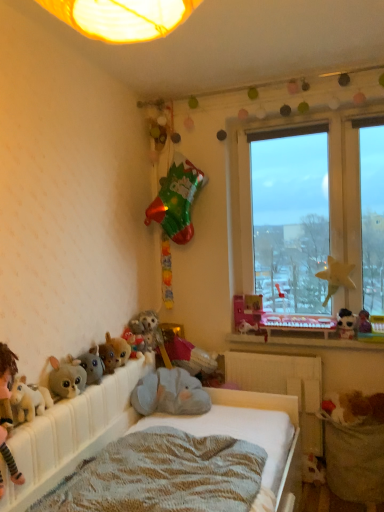
What is the approximate height of fluffy plush elephant at center, which is the 7th toy in left-to-right order?

It is 30.54 centimeters.

What is the approximate width of pink matte book at window, positioned as the 1th toy in right-to-left order?

It is 4.46 inches.

Where is `wooden at lower right`? This screenshot has height=512, width=384. wooden at lower right is located at coordinates (299, 341).

Find the location of `transparent glass window at upper right`. transparent glass window at upper right is located at coordinates (301, 221).

What do you see at coordinates (301, 221) in the screenshot?
I see `transparent glass window at upper right` at bounding box center [301, 221].

Where is `fluffy plush elephant at center, which appears as the 2th toy when viewed from the right`? The image size is (384, 512). fluffy plush elephant at center, which appears as the 2th toy when viewed from the right is located at coordinates (187, 355).

Is point (247, 328) in front of point (10, 465)?

That is False.

Who is taller, pink matte book at window, positioned as the 1th toy in right-to-left order, or fluffy plush toy at lower left?

fluffy plush toy at lower left is taller.

Is pink matte book at window, positioned as the eighth toy in left-to-right order, directly adjacent to fluffy plush toy at lower left?

They are not placed beside each other.

Does point (316, 406) appear closer or farther from the camera than point (185, 379)?

Point (316, 406) is positioned farther from the camera compared to point (185, 379).

Which of these two, white plastic radiator at center or soft plush toy at center, the third toy viewed from the right, is thinner?

With smaller width is white plastic radiator at center.

Is white plastic radiator at center directly adjacent to soft plush toy at center, marked as the 6th toy in a left-to-right arrangement?

white plastic radiator at center and soft plush toy at center, marked as the 6th toy in a left-to-right arrangement, are not in contact.

Is soft plush toy at center, the third toy viewed from the right, located within white plastic radiator at center?

No, soft plush toy at center, the third toy viewed from the right, is not inside white plastic radiator at center.

Is fluffy plush elephant at center, which appears as the 2th toy when viewed from the right, far from soft plush toy at center, the third toy viewed from the right?

fluffy plush elephant at center, which appears as the 2th toy when viewed from the right, is actually quite close to soft plush toy at center, the third toy viewed from the right.

Can you confirm if fluffy plush elephant at center, which appears as the 2th toy when viewed from the right, is taller than soft plush toy at center, marked as the 6th toy in a left-to-right arrangement?

Indeed, fluffy plush elephant at center, which appears as the 2th toy when viewed from the right, has a greater height compared to soft plush toy at center, marked as the 6th toy in a left-to-right arrangement.

From the image's perspective, between fluffy plush elephant at center, which is the 7th toy in left-to-right order, and soft plush toy at center, marked as the 6th toy in a left-to-right arrangement, who is located below?

soft plush toy at center, marked as the 6th toy in a left-to-right arrangement.

How many degrees apart are the facing directions of fluffy plush elephant at center, which is the 7th toy in left-to-right order, and white plastic radiator at center?

90 degrees separate the facing orientations of fluffy plush elephant at center, which is the 7th toy in left-to-right order, and white plastic radiator at center.

Is fluffy plush elephant at center, which appears as the 2th toy when viewed from the right, in front of white plastic radiator at center?

That is False.

Is fluffy plush elephant at center, which appears as the 2th toy when viewed from the right, facing away from white plastic radiator at center?

fluffy plush elephant at center, which appears as the 2th toy when viewed from the right, does not have its back to white plastic radiator at center.

Can you confirm if fluffy plush elephant at center, which appears as the 2th toy when viewed from the right, is taller than white plastic radiator at center?

In fact, fluffy plush elephant at center, which appears as the 2th toy when viewed from the right, may be shorter than white plastic radiator at center.

Can you tell me how much fluffy plush toy at lower left and fluffy plush toy at lower left, the first toy in the left-to-right sequence, differ in facing direction?

There is a 0.00115-degree angle between the facing directions of fluffy plush toy at lower left and fluffy plush toy at lower left, the first toy in the left-to-right sequence.

Does fluffy plush toy at lower left have a greater height compared to fluffy plush toy at lower left, the first toy in the left-to-right sequence?

Yes.

From the image's perspective, relative to fluffy plush toy at lower left, acting as the 8th toy starting from the right, is fluffy plush toy at lower left above or below?

Clearly, from the image's perspective, fluffy plush toy at lower left is below fluffy plush toy at lower left, acting as the 8th toy starting from the right.

Locate an element on the screen. The width and height of the screenshot is (384, 512). the 1st toy behind the fluffy plush toy at lower left, counting from the anchor's position is located at coordinates (28, 400).

Is brown plush toy at lower left, the 5th toy in the right-to-left sequence, closer to the viewer compared to fluffy plush toy at lower left, which appears as the 3th toy when viewed from the left?

No, brown plush toy at lower left, the 5th toy in the right-to-left sequence, is further to the viewer.

Is point (119, 348) closer to viewer compared to point (95, 350)?

No, it is behind (95, 350).

Is brown plush toy at lower left, the 5th toy in the right-to-left sequence, spatially inside fluffy plush toy at lower left, which appears as the 3th toy when viewed from the left, or outside of it?

brown plush toy at lower left, the 5th toy in the right-to-left sequence, cannot be found inside fluffy plush toy at lower left, which appears as the 3th toy when viewed from the left.

Is point (106, 336) positioned after point (95, 392)?

Yes, it is behind point (95, 392).

Is brown plush toy at lower left, the fourth toy viewed from the left, positioned with its back to soft plush bed at lower left?

No, brown plush toy at lower left, the fourth toy viewed from the left,'s orientation is not away from soft plush bed at lower left.

Can you confirm if brown plush toy at lower left, the fourth toy viewed from the left, is thinner than soft plush bed at lower left?

Yes.

Locate an element on the screen. This screenshot has width=384, height=512. bed below the brown plush toy at lower left, the 5th toy in the right-to-left sequence (from a real-world perspective) is located at coordinates (174, 422).

Locate an element on the screen. This screenshot has height=512, width=384. person below the pink matte book at window, positioned as the 1th toy in right-to-left order (from a real-world perspective) is located at coordinates (7, 408).

Find the location of a particular element. The height and width of the screenshot is (512, 384). the 2nd toy in front of the white plastic radiator at center is located at coordinates (170, 393).

Estimate the real-world distances between objects in this image. Which object is closer to fluffy plush toy at lower left, brown plush toy at lower left, the fourth toy viewed from the left, or fluffy plush toy at lower left, acting as the 8th toy starting from the right?

Among the two, fluffy plush toy at lower left, acting as the 8th toy starting from the right, is located nearer to fluffy plush toy at lower left.

Based on their spatial positions, is fluffy plush toy at center, the 5th toy viewed from the left, or fluffy plush toy at lower left, which appears as the 3th toy when viewed from the left, further from fluffy plush toy at lower left, acting as the 8th toy starting from the right?

Based on the image, fluffy plush toy at center, the 5th toy viewed from the left, appears to be further to fluffy plush toy at lower left, acting as the 8th toy starting from the right.

When comparing their distances from fluffy plush elephant at center, which appears as the 2th toy when viewed from the right, does white plastic radiator at center or wooden at lower right seem further?

wooden at lower right is further to fluffy plush elephant at center, which appears as the 2th toy when viewed from the right.

When comparing their distances from knitted fabric mattress at lower center, does soft plush toy at center, the third toy viewed from the right, or white plastic radiator at center seem further?

white plastic radiator at center lies further to knitted fabric mattress at lower center than the other object.

From the image, which object appears to be nearer to soft plush toy at center, marked as the 6th toy in a left-to-right arrangement, soft plush bed at lower left or yellow fabric star at window, which ranks as the second miniature in bottom-to-top order?

The object closer to soft plush toy at center, marked as the 6th toy in a left-to-right arrangement, is soft plush bed at lower left.

Based on the photo, considering their positions, is wooden at lower right positioned closer to pink matte book at window, positioned as the 1th toy in right-to-left order, than white plastic radiator at center?

Based on the image, wooden at lower right appears to be nearer to pink matte book at window, positioned as the 1th toy in right-to-left order.

From the picture: Looking at the image, which one is located closer to white plastic radiator at center, soft plush toy at center, marked as the 6th toy in a left-to-right arrangement, or fluffy plush toy at lower left?

soft plush toy at center, marked as the 6th toy in a left-to-right arrangement, is closer to white plastic radiator at center.

From the image, which object appears to be nearer to fluffy plush toy at center, which is the 4th toy in right-to-left order, soft plush toy at center, the third toy viewed from the right, or fluffy plush elephant at center, which is the 7th toy in left-to-right order?

Based on the image, fluffy plush elephant at center, which is the 7th toy in left-to-right order, appears to be nearer to fluffy plush toy at center, which is the 4th toy in right-to-left order.

Locate an element on the screen. This screenshot has height=512, width=384. window sill between soft plush bed at lower left and fluffy plush elephant at center, which is the 7th toy in left-to-right order, in the front-back direction is located at coordinates (299, 341).

Locate an element on the screen. window sill between fluffy plush toy at lower left, the first toy in the left-to-right sequence, and white plush toy at right, which appears as the second miniature when viewed from the top, in the horizontal direction is located at coordinates (299, 341).

Where is `miniature between fluffy plush toy at lower left, acting as the 8th toy starting from the right, and white plush toy at right, which appears as the second miniature when viewed from the top, from left to right`? miniature between fluffy plush toy at lower left, acting as the 8th toy starting from the right, and white plush toy at right, which appears as the second miniature when viewed from the top, from left to right is located at coordinates (336, 277).

Where is `mattress between fluffy plush toys at lower left, placed as the second toy when sorted from left to right, and wooden at lower right from left to right`? Image resolution: width=384 pixels, height=512 pixels. mattress between fluffy plush toys at lower left, placed as the second toy when sorted from left to right, and wooden at lower right from left to right is located at coordinates (162, 475).